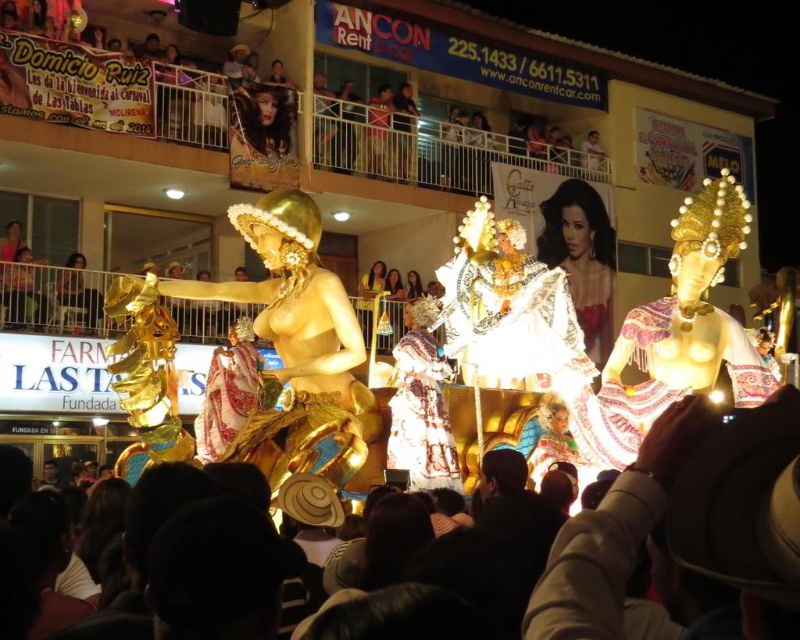
Question: Is white lace dress at center above embroidered silk dress at center?

Choices:
 (A) no
 (B) yes

Answer: (B)

Question: Does white lace dress at center have a smaller size compared to gold metallic fabric at center?

Choices:
 (A) no
 (B) yes

Answer: (B)

Question: Which of these objects is positioned farthest from the dark brown leather hat at lower center?

Choices:
 (A) gold metallic fabric at center
 (B) gold metallic statue at center

Answer: (A)

Question: Is dark brown leather hat at lower center positioned at the back of gold metallic statue at center?

Choices:
 (A) no
 (B) yes

Answer: (A)

Question: Considering the real-world distances, which object is farthest from the embroidered silk dress at center?

Choices:
 (A) gold metallic statue at center
 (B) embroidered fabric dress at center
 (C) gold metallic fabric at center
 (D) white lace dress at center

Answer: (C)

Question: Which object appears closest to the camera in this image?

Choices:
 (A) white lace dress at center
 (B) gold metallic fabric at center

Answer: (B)